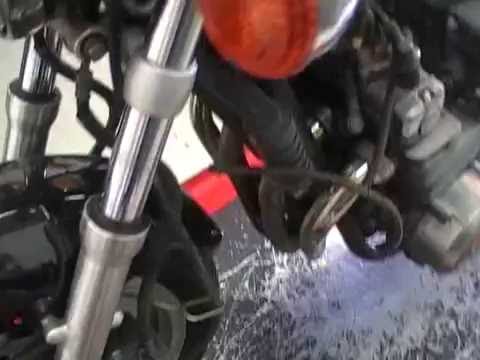
This screenshot has width=480, height=360. What are the coordinates of `white floor` in the screenshot? It's located at (12, 46), (61, 132), (194, 152), (104, 71), (98, 103), (66, 93).